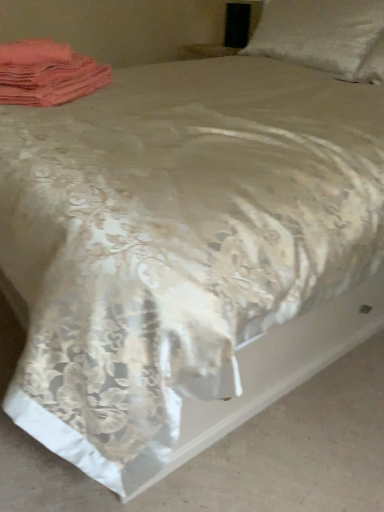
Question: Can you confirm if silky beige bedspread at center is bigger than pink fabric at upper left?

Choices:
 (A) yes
 (B) no

Answer: (A)

Question: Is the surface of silky beige bedspread at center in direct contact with pink fabric at upper left?

Choices:
 (A) yes
 (B) no

Answer: (B)

Question: Does silky beige bedspread at center contain pink fabric at upper left?

Choices:
 (A) no
 (B) yes

Answer: (A)

Question: Can you confirm if silky beige bedspread at center is positioned to the left of pink fabric at upper left?

Choices:
 (A) no
 (B) yes

Answer: (A)

Question: From a real-world perspective, is silky beige bedspread at center physically above pink fabric at upper left?

Choices:
 (A) no
 (B) yes

Answer: (A)

Question: Looking at their shapes, would you say satin white pillow at upper right is wider or thinner than pink fabric at upper left?

Choices:
 (A) thin
 (B) wide

Answer: (B)

Question: Do you think satin white pillow at upper right is within pink fabric at upper left, or outside of it?

Choices:
 (A) outside
 (B) inside

Answer: (A)

Question: Considering the positions of satin white pillow at upper right and pink fabric at upper left in the image, is satin white pillow at upper right bigger or smaller than pink fabric at upper left?

Choices:
 (A) small
 (B) big

Answer: (B)

Question: Is point (339, 38) closer or farther from the camera than point (19, 75)?

Choices:
 (A) closer
 (B) farther

Answer: (B)

Question: Relative to silky beige bedspread at center, is satin white pillow at upper right in front or behind?

Choices:
 (A) front
 (B) behind

Answer: (B)

Question: From the image's perspective, is satin white pillow at upper right located above or below silky beige bedspread at center?

Choices:
 (A) above
 (B) below

Answer: (A)

Question: Considering the positions of point (322, 14) and point (205, 504), is point (322, 14) closer or farther from the camera than point (205, 504)?

Choices:
 (A) closer
 (B) farther

Answer: (B)

Question: From a real-world perspective, is satin white pillow at upper right above or below silky beige bedspread at center?

Choices:
 (A) above
 (B) below

Answer: (A)

Question: Considering the positions of point (38, 104) and point (246, 501), is point (38, 104) closer or farther from the camera than point (246, 501)?

Choices:
 (A) closer
 (B) farther

Answer: (B)

Question: Looking at the image, does pink fabric at upper left seem bigger or smaller compared to silky beige bedspread at center?

Choices:
 (A) big
 (B) small

Answer: (B)